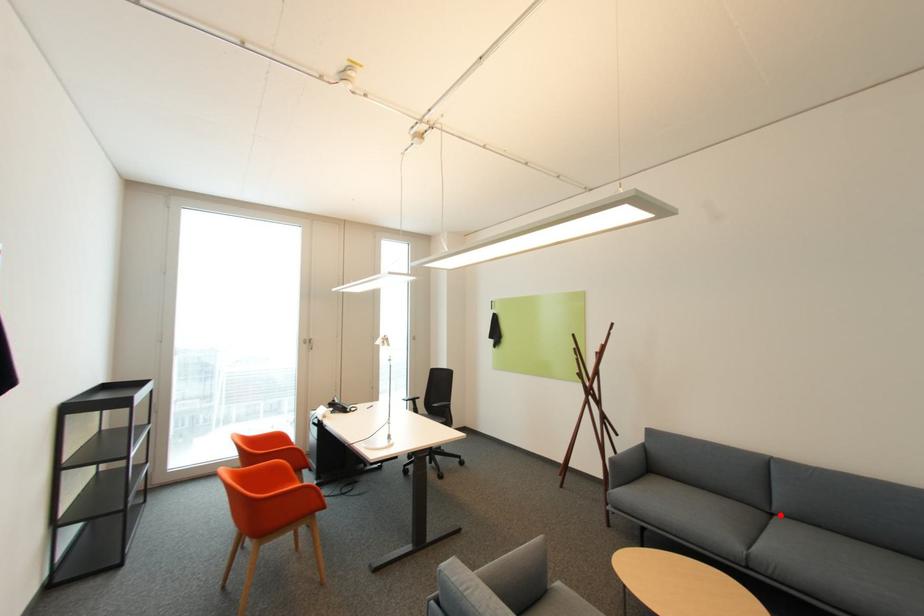
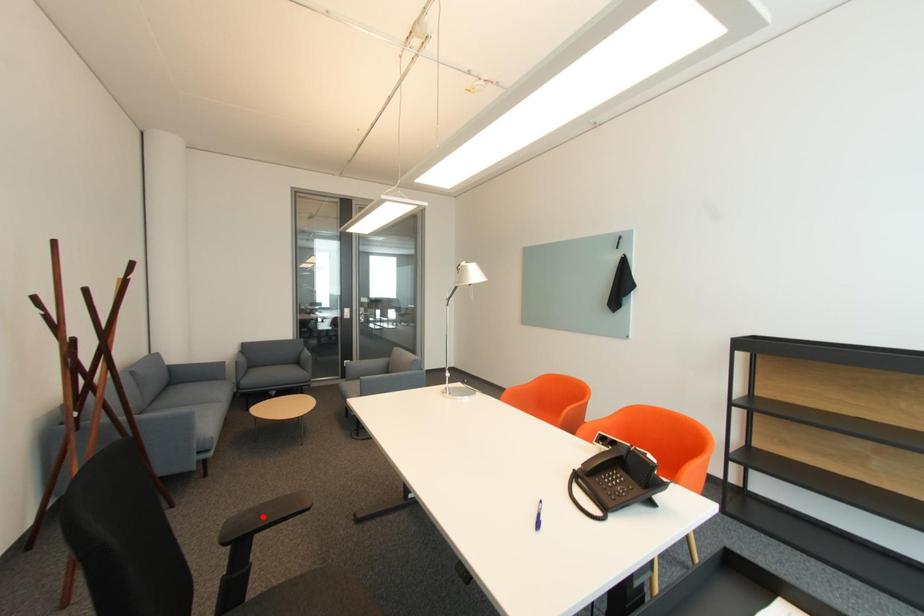
I am providing you with two images of the same scene from different viewpoints. A red point is marked on the first image and another point is marked on the second image. Do the highlighted points in image1 and image2 indicate the same real-world spot?

No